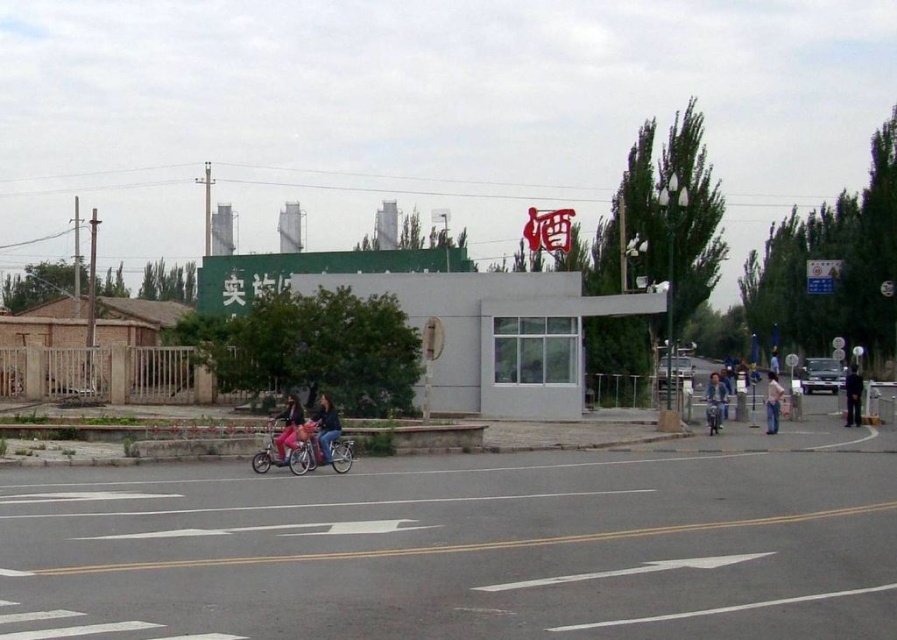
Question: Among these points, which one is nearest to the camera?

Choices:
 (A) (712, 422)
 (B) (293, 435)

Answer: (B)

Question: Among these points, which one is farthest from the camera?

Choices:
 (A) (320, 442)
 (B) (777, 400)
 (C) (710, 420)

Answer: (B)

Question: Observing the image, what is the correct spatial positioning of metallic silver bicycle at center in reference to denim jacket at center?

Choices:
 (A) right
 (B) left

Answer: (B)

Question: Estimate the real-world distances between objects in this image. Which object is farther from the dark blue uniform at center?

Choices:
 (A) pink fabric pants at center
 (B) light blue jeans at lower right

Answer: (A)

Question: Can you confirm if metallic silver bicycle at center is thinner than pink fabric pants at center?

Choices:
 (A) yes
 (B) no

Answer: (A)

Question: Does metallic silver bicycle at center have a greater width compared to light blue jeans at lower right?

Choices:
 (A) yes
 (B) no

Answer: (B)